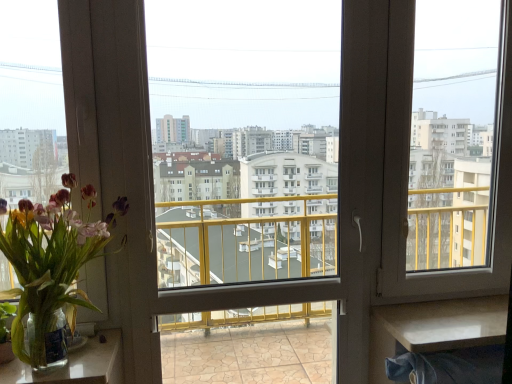
Find the location of a particular element. This screenshot has height=384, width=512. free space above white glossy table at lower right, marked as the 1th table in a right-to-left arrangement (from a real-world perspective) is located at coordinates tap(457, 316).